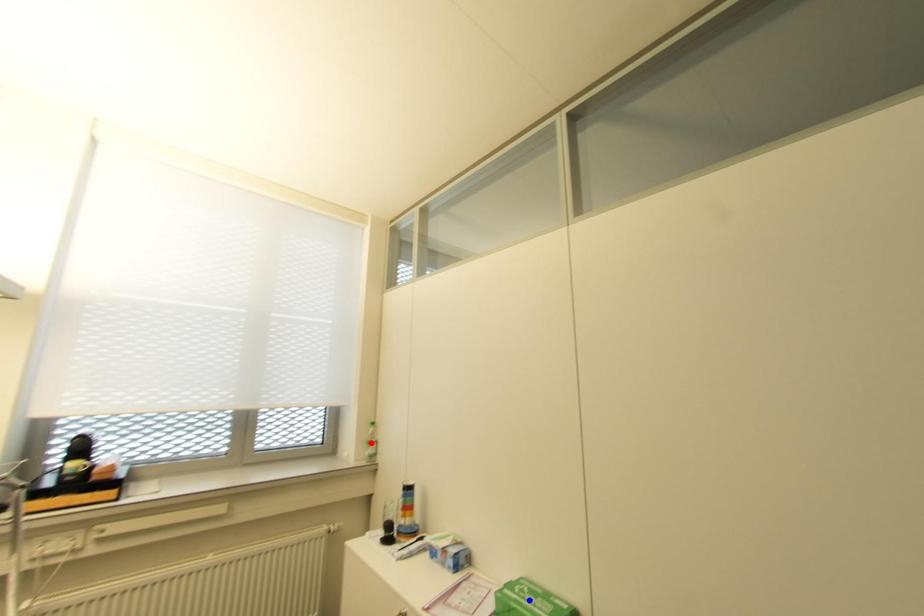
Question: Two points are marked on the image. Which point is closer to the camera?

Choices:
 (A) Blue point is closer.
 (B) Red point is closer.

Answer: (A)